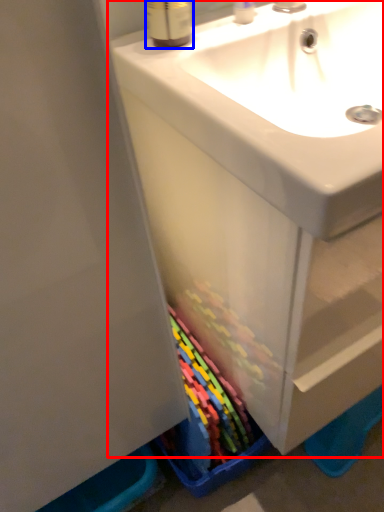
Question: Which point is closer to the camera, bathroom cabinet (highlighted by a red box) or mouthwash (highlighted by a blue box)?

Choices:
 (A) bathroom cabinet
 (B) mouthwash

Answer: (A)